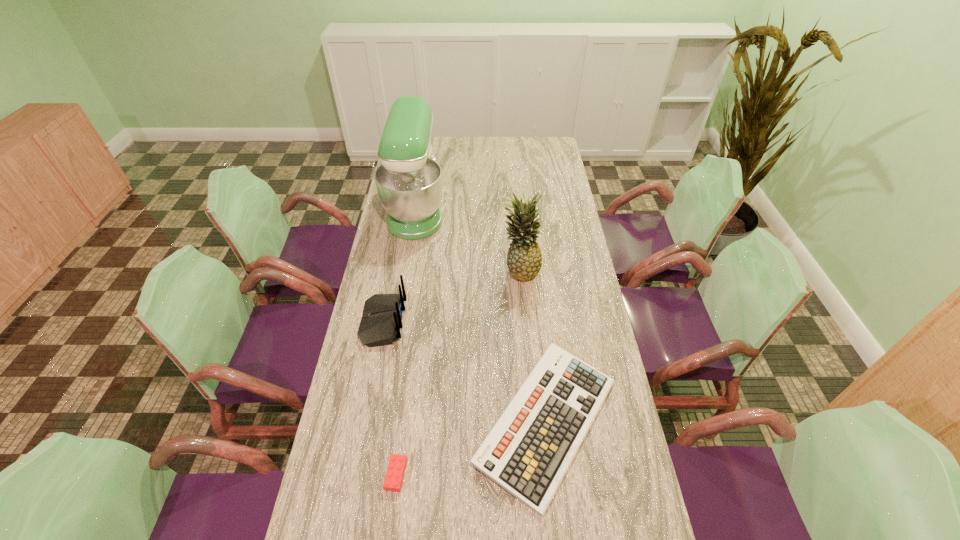
Find the location of a particular element. vacant region that satisfies the following two spatial constraints: 1. on the back of the third shortest object; 2. on the back side of the fourth tallest object is located at coordinates (364, 422).